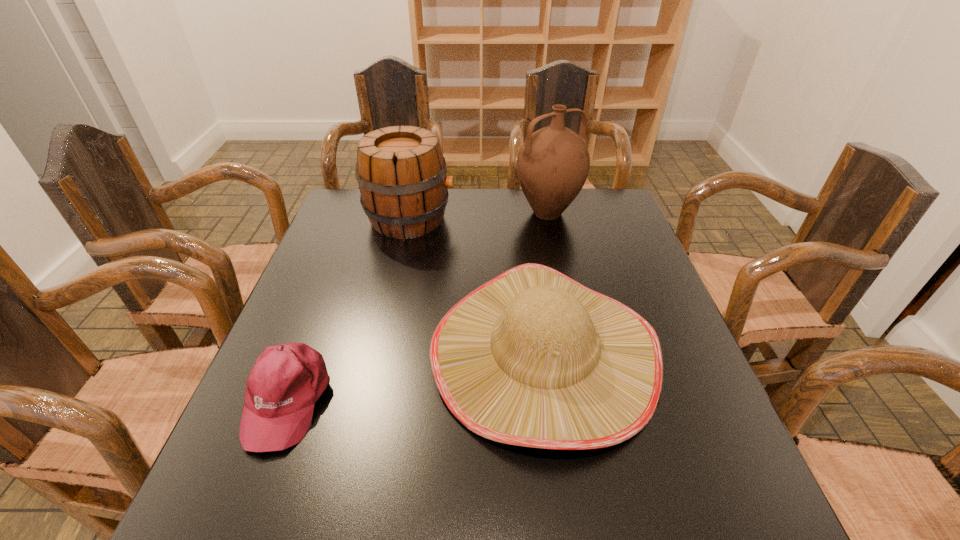
This screenshot has width=960, height=540. Find the location of `free region that satisfies the following two spatial constraints: 1. on the side of the cider where the spigot is located; 2. on the right side of the second shortest object`. free region that satisfies the following two spatial constraints: 1. on the side of the cider where the spigot is located; 2. on the right side of the second shortest object is located at coordinates (381, 353).

You are a GUI agent. You are given a task and a screenshot of the screen. Output one action in this format:
    pyautogui.click(x=<x>, y=<y>)
    Task: Click on the vacant region that satisfies the following two spatial constraints: 1. on the side of the sunhat where the spigot is located; 2. on the left side of the second tallest object
    This screenshot has height=540, width=960.
    Given the screenshot: What is the action you would take?
    point(381,353)

This screenshot has width=960, height=540. I want to click on vacant space that satisfies the following two spatial constraints: 1. on the side of the second tallest object where the spigot is located; 2. at the front of the shortest object with the brim, so click(372, 400).

The height and width of the screenshot is (540, 960). Identify the location of blank space that satisfies the following two spatial constraints: 1. on the side of the third tallest object where the spigot is located; 2. on the left side of the second tallest object. (381, 353).